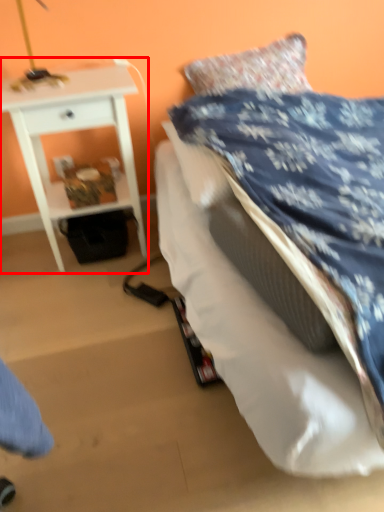
Question: Where is nightstand (annotated by the red box) located in relation to bed in the image?

Choices:
 (A) left
 (B) right

Answer: (A)